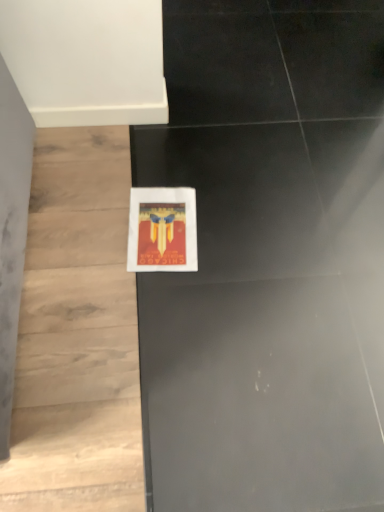
At what (x,y) coordinates should I click in order to perform the action: click on free point behind matte paper picture frame at center. Please return your answer as a coordinate pair (x, y). Looking at the image, I should click on (169, 166).